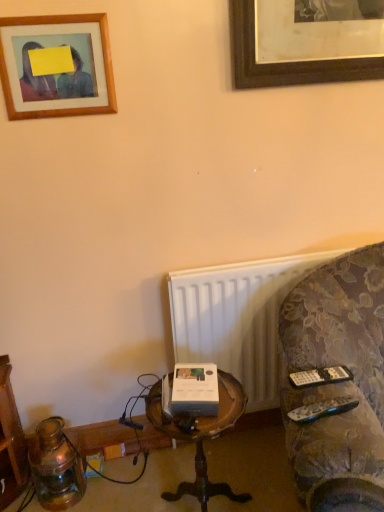
Locate an element on the screen. empty space that is to the right of antique brass lantern at lower left is located at coordinates (112, 484).